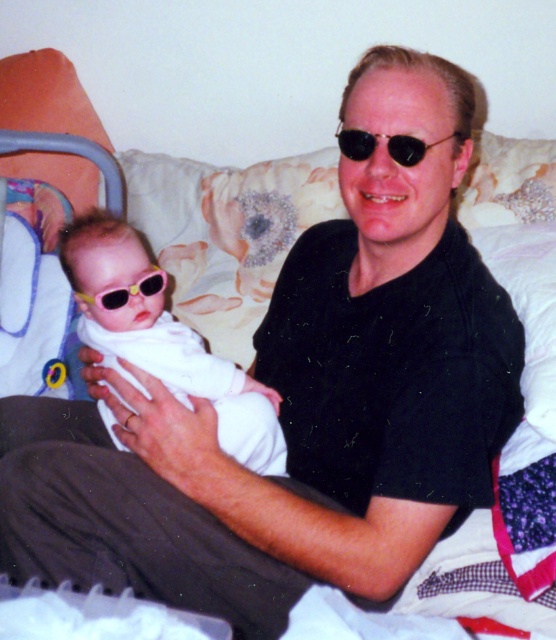
You are a photographer adjusting lighting for a photo shoot. You notice the black matte sunglasses at upper center and the yellow plastic goggles at center. Which object has a greater width according to the scene?

The black matte sunglasses at upper center has a greater width than the yellow plastic goggles at center.

You are a photographer setting up for a photoshoot in the bedroom. You need to place a small prop between the white soft baby at center and the black matte sunglasses at upper center. Based on their positions, where should you place the prop to ensure it is between them?

The white soft baby at center is positioned on the left side of the black matte sunglasses at upper center, so you should place the prop between them on the right side of the white soft baby at center and the left side of the black matte sunglasses at upper center.